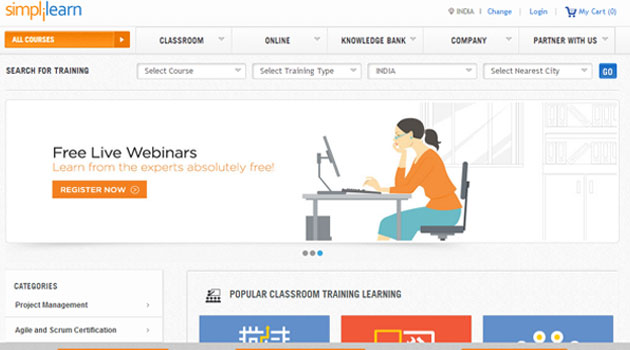
You are a GUI agent. You are given a task and a screenshot of the screen. Output one action in this format:
    pyautogui.click(x=<x>, y=<y>)
    Task: Click on the computer desk
    
    Given the screenshot: What is the action you would take?
    pyautogui.click(x=358, y=193)